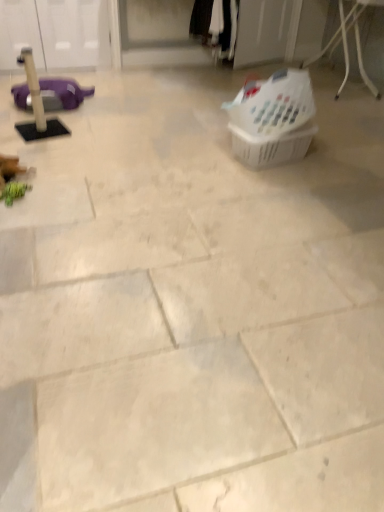
Question: Visually, is black cotton pants at upper center positioned to the left or to the right of metallic wire basket at upper right?

Choices:
 (A) left
 (B) right

Answer: (A)

Question: Based on their sizes in the image, would you say black cotton pants at upper center is bigger or smaller than metallic wire basket at upper right?

Choices:
 (A) big
 (B) small

Answer: (B)

Question: Based on their relative distances, which object is nearer to the white plastic laundry basket at upper right, the first basket viewed from the top?

Choices:
 (A) translucent plastic basket at center-right, the second basket viewed from the top
 (B) black cotton pants at upper center
 (C) metallic wire basket at upper right

Answer: (A)

Question: Which is nearer to the metallic wire basket at upper right?

Choices:
 (A) white plastic laundry basket at upper right, acting as the 2th basket starting from the bottom
 (B) translucent plastic basket at center-right, the first basket ordered from the bottom
 (C) black cotton pants at upper center

Answer: (C)